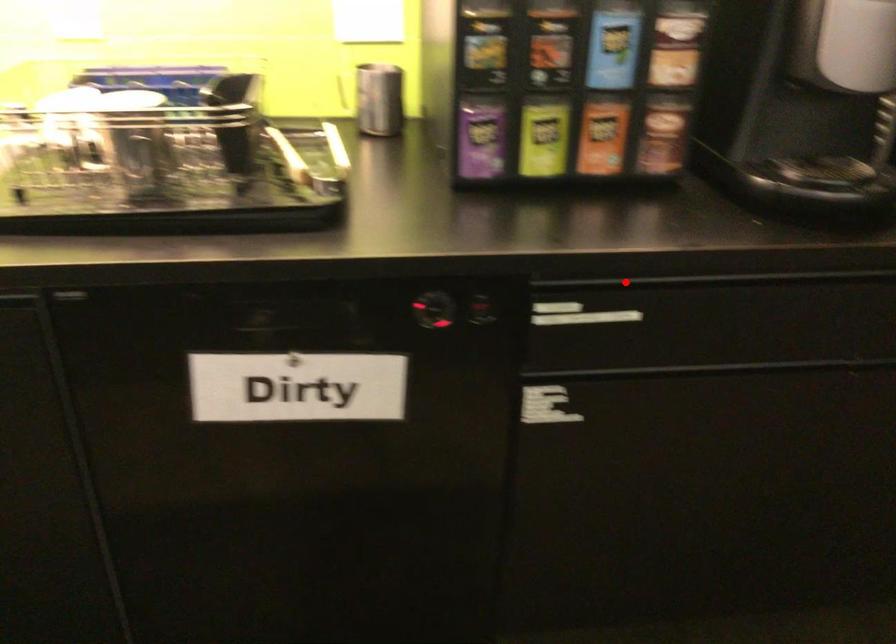
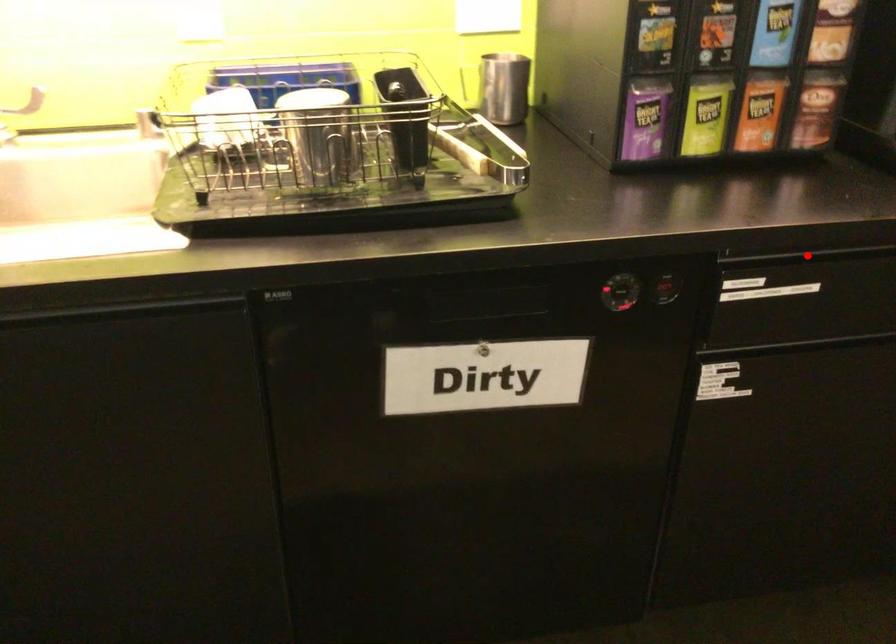
I am providing you with two images of the same scene from different viewpoints. A red point is marked on the first image and another point is marked on the second image. Is the red point in image1 aligned with the point shown in image2?

Yes